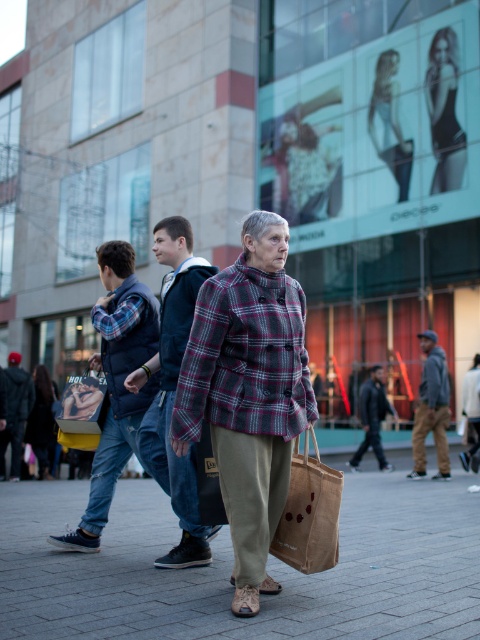
Question: Is plaid fabric at center thinner than dark gray fabric jacket at left?

Choices:
 (A) no
 (B) yes

Answer: (A)

Question: Which of the following is the closest to the observer?

Choices:
 (A) dark gray jacket at center
 (B) plaid fabric at center
 (C) denim jeans at left
 (D) gray hoodie at right

Answer: (B)

Question: Is plaid fabric at center bigger than brown jute bag at lower center?

Choices:
 (A) yes
 (B) no

Answer: (A)

Question: Which point is farther to the camera?

Choices:
 (A) brown woven bag at center
 (B) dark gray jacket at center
 (C) plaid fabric at center
 (D) dark gray fabric jacket at left

Answer: (B)

Question: Among these objects, which one is farthest from the camera?

Choices:
 (A) brown woven bag at center
 (B) gray hoodie at right

Answer: (B)

Question: Does plaid fabric at center have a greater width compared to brown jute bag at lower center?

Choices:
 (A) yes
 (B) no

Answer: (A)